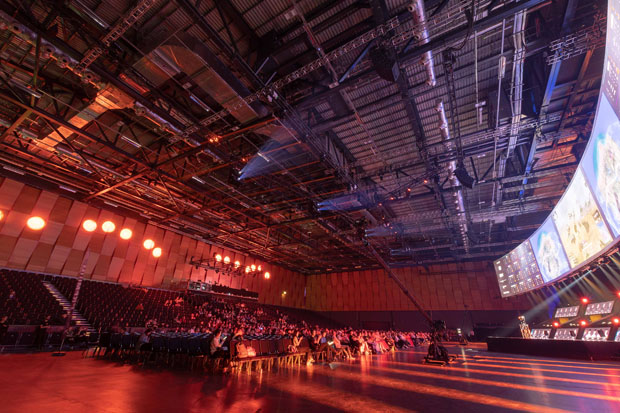
The width and height of the screenshot is (620, 413). I want to click on wall, so click(x=384, y=310), click(x=136, y=279).